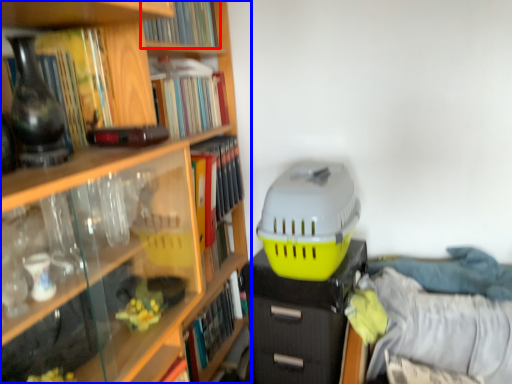
Question: Which object is closer to the camera taking this photo, book (highlighted by a red box) or book (highlighted by a blue box)?

Choices:
 (A) book
 (B) book

Answer: (B)